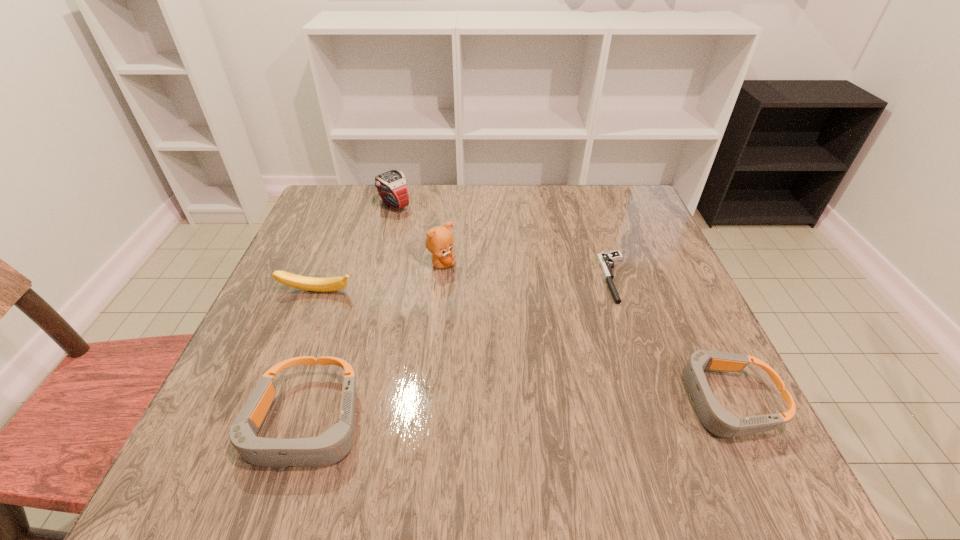
This screenshot has height=540, width=960. I want to click on the left goggles, so click(331, 446).

Locate an element on the screen. the right goggles is located at coordinates (719, 421).

Identify the location of the shorter goggles. (719, 421).

At what (x,y) coordinates should I click in order to perform the action: click on watch. Please return your answer as a coordinate pair (x, y). The width and height of the screenshot is (960, 540). Looking at the image, I should click on (392, 186).

The width and height of the screenshot is (960, 540). I want to click on the farthest object, so click(x=392, y=186).

At what (x,y) coordinates should I click in order to perform the action: click on the tallest object. Please return your answer as a coordinate pair (x, y). Looking at the image, I should click on [x=439, y=241].

In order to click on teddy bear in this screenshot , I will do `click(439, 241)`.

Find the location of a particular element. The image size is (960, 540). the shortest object is located at coordinates (605, 259).

The image size is (960, 540). Identify the location of the second object from right to left. (605, 259).

Image resolution: width=960 pixels, height=540 pixels. Find the location of `banana`. banana is located at coordinates (329, 284).